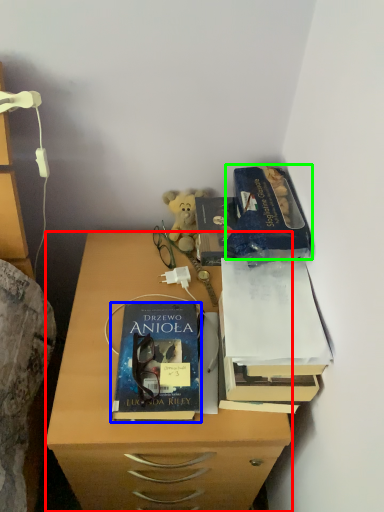
Question: Considering the real-world distances, which object is farthest from desk (highlighted by a red box)? book (highlighted by a blue box) or paperback book (highlighted by a green box)?

Choices:
 (A) book
 (B) paperback book

Answer: (B)